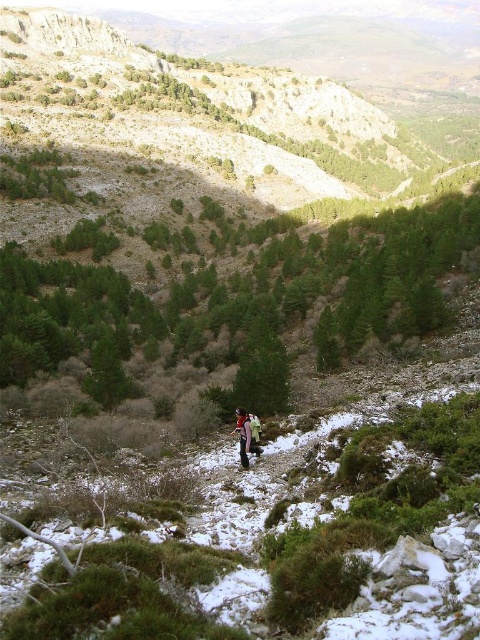
You are a hiker standing at the starting point of the path. You want to reach the green coniferous trees at center. Which direction should you walk to get there?

The green coniferous trees at center are located at point 0.498 on the y axis, so you should walk forward along the path to reach them.